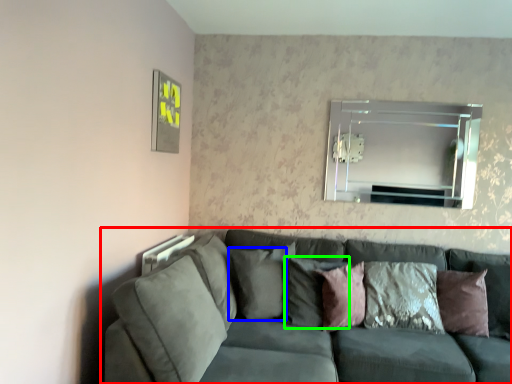
Question: Which object is positioned farthest from studio couch (highlighted by a red box)? Select from pillow (highlighted by a blue box) and pillow (highlighted by a green box).

Choices:
 (A) pillow
 (B) pillow

Answer: (B)